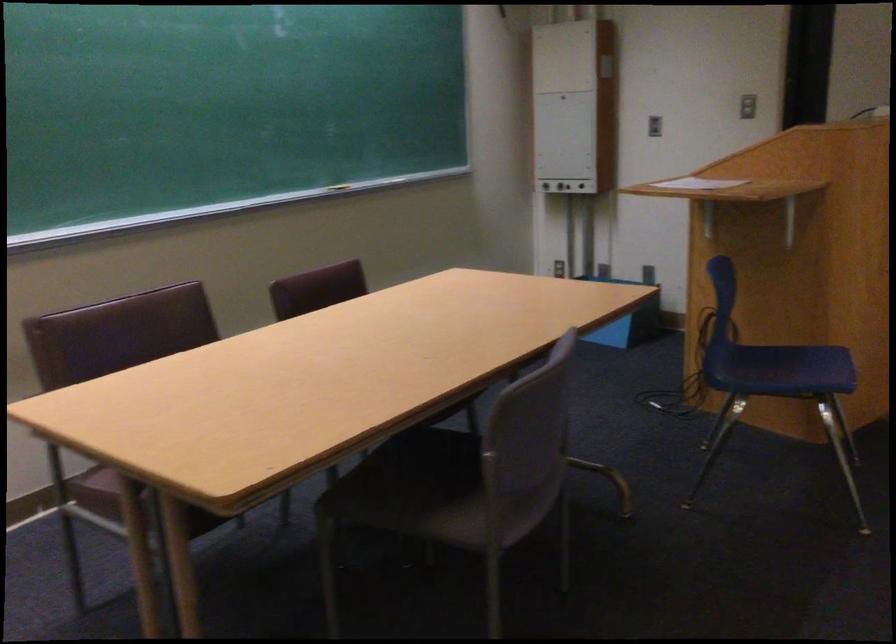
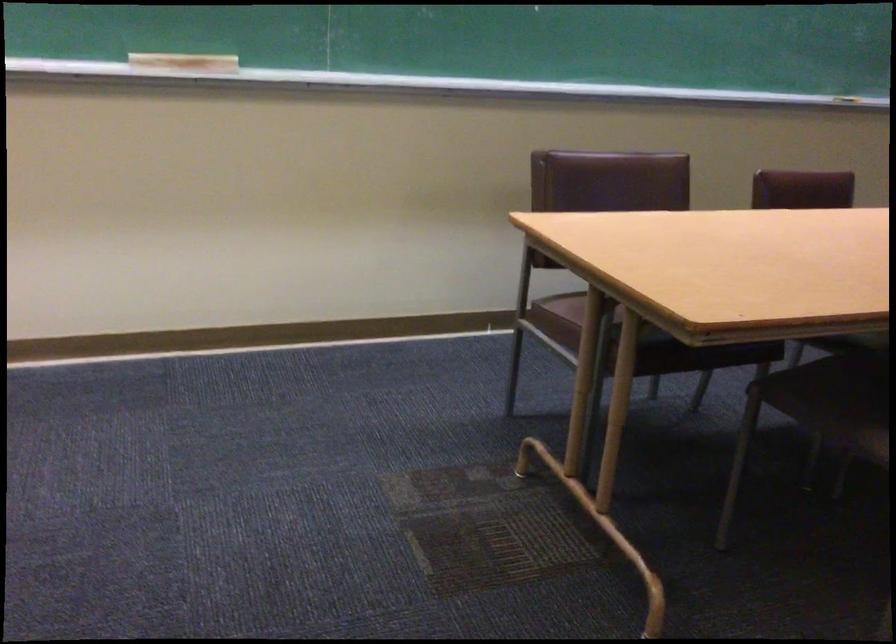
Question: The first image is from the beginning of the video and the second image is from the end. How did the camera likely rotate when shooting the video?

Choices:
 (A) Left
 (B) Right
 (C) Up
 (D) Down

Answer: (A)